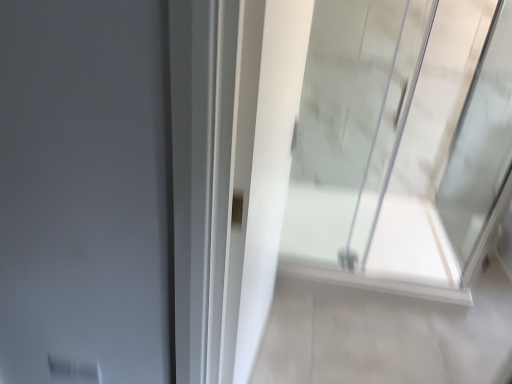
This screenshot has height=384, width=512. What are the coordinates of `transparent glass shower door at right` in the screenshot? It's located at (402, 146).

What do you see at coordinates (402, 146) in the screenshot?
I see `transparent glass shower door at right` at bounding box center [402, 146].

At what (x,y) coordinates should I click in order to perform the action: click on white glossy shower door at center. Please return your answer as a coordinate pair (x, y). Looking at the image, I should click on (385, 335).

What do you see at coordinates (385, 335) in the screenshot? I see `white glossy shower door at center` at bounding box center [385, 335].

Find the location of a particular element. The height and width of the screenshot is (384, 512). transparent glass shower door at right is located at coordinates (402, 146).

Would you say white glossy shower door at center is to the left or to the right of transparent glass shower door at right in the picture?

Based on their positions, white glossy shower door at center is located to the right of transparent glass shower door at right.

Considering the relative positions of white glossy shower door at center and transparent glass shower door at right in the image provided, is white glossy shower door at center behind transparent glass shower door at right?

Yes, white glossy shower door at center is behind transparent glass shower door at right.

Considering the points (466, 380) and (360, 96), which point is in front, point (466, 380) or point (360, 96)?

Positioned in front is point (466, 380).

From the image's perspective, between white glossy shower door at center and transparent glass shower door at right, who is located below?

From the image's view, white glossy shower door at center is below.

From a real-world perspective, which object rests below the other?

white glossy shower door at center.

In terms of width, does white glossy shower door at center look wider or thinner when compared to transparent glass shower door at right?

white glossy shower door at center is wider than transparent glass shower door at right.

In terms of height, does white glossy shower door at center look taller or shorter compared to transparent glass shower door at right?

Considering their sizes, white glossy shower door at center has less height than transparent glass shower door at right.

Which of these two, white glossy shower door at center or transparent glass shower door at right, is smaller?

transparent glass shower door at right is smaller.

Is white glossy shower door at center completely or partially outside of transparent glass shower door at right?

Indeed, white glossy shower door at center is completely outside transparent glass shower door at right.

Is white glossy shower door at center next to transparent glass shower door at right?

No.

Is white glossy shower door at center looking in the opposite direction of transparent glass shower door at right?

white glossy shower door at center is not turned away from transparent glass shower door at right.

How different are the orientations of white glossy shower door at center and transparent glass shower door at right in degrees?

There is a 0.00305-degree angle between the facing directions of white glossy shower door at center and transparent glass shower door at right.

The width and height of the screenshot is (512, 384). What are the coordinates of `window on the left of white glossy shower door at center` in the screenshot? It's located at (402, 146).

Is transparent glass shower door at right to the left or to the right of white glossy shower door at center in the image?

Based on their positions, transparent glass shower door at right is located to the left of white glossy shower door at center.

Is the depth of transparent glass shower door at right less than that of white glossy shower door at center?

Yes, transparent glass shower door at right is closer to the viewer.

Considering the points (468, 109) and (380, 332), which point is in front, point (468, 109) or point (380, 332)?

The point (380, 332) is closer to the camera.

From the image's perspective, is transparent glass shower door at right over white glossy shower door at center?

Correct, transparent glass shower door at right appears higher than white glossy shower door at center in the image.

From a real-world perspective, is transparent glass shower door at right located beneath white glossy shower door at center?

No.

Between transparent glass shower door at right and white glossy shower door at center, which one has larger width?

white glossy shower door at center.

Which of these two, transparent glass shower door at right or white glossy shower door at center, stands taller?

Standing taller between the two is transparent glass shower door at right.

Between transparent glass shower door at right and white glossy shower door at center, which one has smaller size?

Answer: Smaller between the two is transparent glass shower door at right.

Is transparent glass shower door at right surrounding white glossy shower door at center?

No.

Is transparent glass shower door at right next to white glossy shower door at center and touching it?

transparent glass shower door at right and white glossy shower door at center are clearly separated.

Is transparent glass shower door at right facing towards white glossy shower door at center?

No, transparent glass shower door at right does not turn towards white glossy shower door at center.

In the scene shown: What's the angular difference between transparent glass shower door at right and white glossy shower door at center's facing directions?

The facing directions of transparent glass shower door at right and white glossy shower door at center are 0.00305 degrees apart.

The image size is (512, 384). I want to click on window above the white glossy shower door at center (from a real-world perspective), so click(402, 146).

In order to click on window located in front of the white glossy shower door at center in this screenshot , I will do `click(402, 146)`.

At what (x,y) coordinates should I click in order to perform the action: click on path on the right of transparent glass shower door at right. Please return your answer as a coordinate pair (x, y). The image size is (512, 384). Looking at the image, I should click on (385, 335).